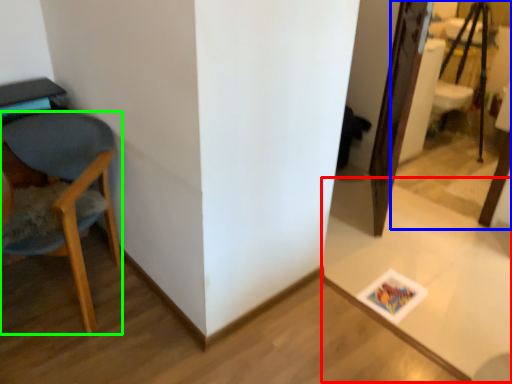
Question: Which object is positioned closest to table (highlighted by a red box)? Select from mirror (highlighted by a blue box) and chair (highlighted by a green box).

Choices:
 (A) mirror
 (B) chair

Answer: (B)